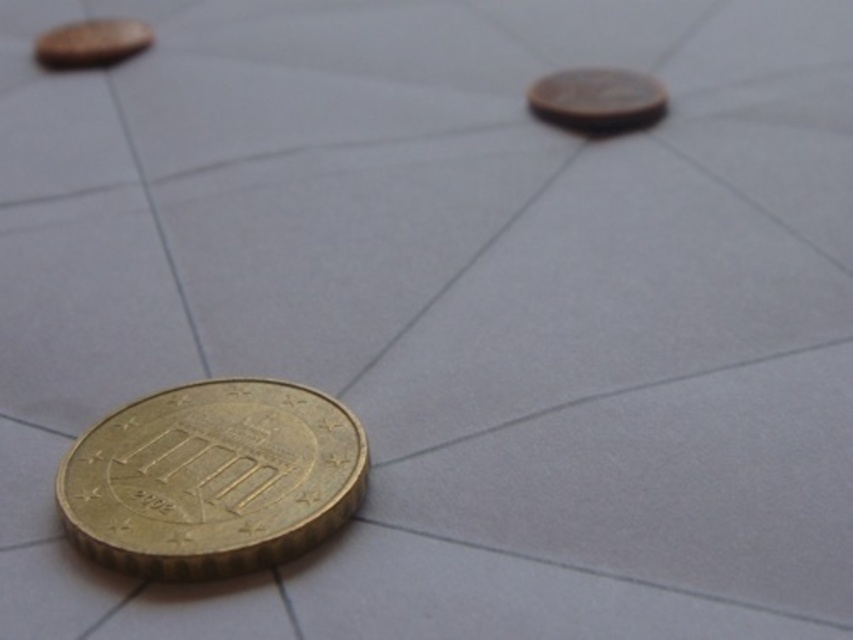
Question: Estimate the real-world distances between objects in this image. Which object is farther from the brass metallic coin at upper right?

Choices:
 (A) matte gold coin at upper left
 (B) gold metallic coin at lower left

Answer: (A)

Question: Is gold metallic coin at lower left below brass metallic coin at upper right?

Choices:
 (A) no
 (B) yes

Answer: (B)

Question: In this image, where is gold metallic coin at lower left located relative to brass metallic coin at upper right?

Choices:
 (A) left
 (B) right

Answer: (A)

Question: Is gold metallic coin at lower left further to the viewer compared to brass metallic coin at upper right?

Choices:
 (A) no
 (B) yes

Answer: (A)

Question: Which object is farther from the camera taking this photo?

Choices:
 (A) gold metallic coin at lower left
 (B) brass metallic coin at upper right
 (C) matte gold coin at upper left

Answer: (C)

Question: Which object appears closest to the camera in this image?

Choices:
 (A) gold metallic coin at lower left
 (B) brass metallic coin at upper right

Answer: (A)